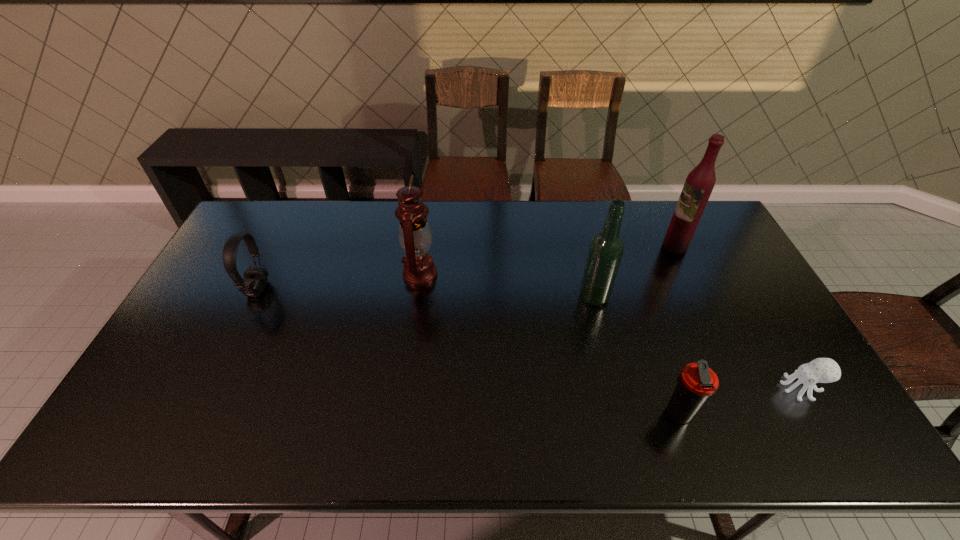
Locate an element on the screen. The image size is (960, 540). object that is the third closest one to the farthest object is located at coordinates (696, 382).

At what (x,y) coordinates should I click in order to perform the action: click on object that stands as the fifth closest to the headset. Please return your answer as a coordinate pair (x, y). This screenshot has width=960, height=540. Looking at the image, I should click on (820, 370).

I want to click on free space that satisfies the following two spatial constraints: 1. on the back side of the left liquor; 2. on the front-facing side of the headset, so click(592, 289).